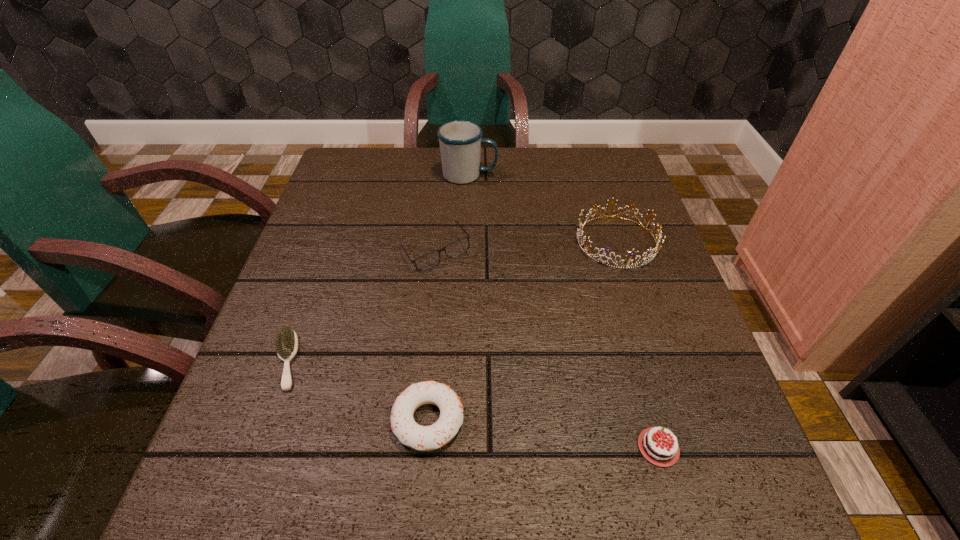
What are the coordinates of `mug` in the screenshot? It's located at (460, 141).

The height and width of the screenshot is (540, 960). What are the coordinates of `the tallest object` in the screenshot? It's located at (460, 141).

This screenshot has height=540, width=960. Identify the location of tiara. (651, 256).

At what (x,y) coordinates should I click in order to perform the action: click on spectacles. Please return your answer as a coordinate pair (x, y). The height and width of the screenshot is (540, 960). Looking at the image, I should click on (431, 259).

Locate an element on the screen. The height and width of the screenshot is (540, 960). doughnut is located at coordinates (421, 438).

Locate an element on the screen. Image resolution: width=960 pixels, height=540 pixels. the second shortest object is located at coordinates (660, 452).

You are a GUI agent. You are given a task and a screenshot of the screen. Output one action in this format:
    pyautogui.click(x=<x>, y=<y>)
    Task: Click on the leftmost object
    The image size is (960, 540).
    Given the screenshot: What is the action you would take?
    pyautogui.click(x=286, y=342)

Where is `scrubbing brush`? scrubbing brush is located at coordinates (286, 342).

What are the coordinates of `vacant space located on the handle side of the farthest object` in the screenshot? It's located at (600, 175).

Locate an element on the screen. The image size is (960, 540). vacant region located on the front-facing side of the second tallest object is located at coordinates (687, 458).